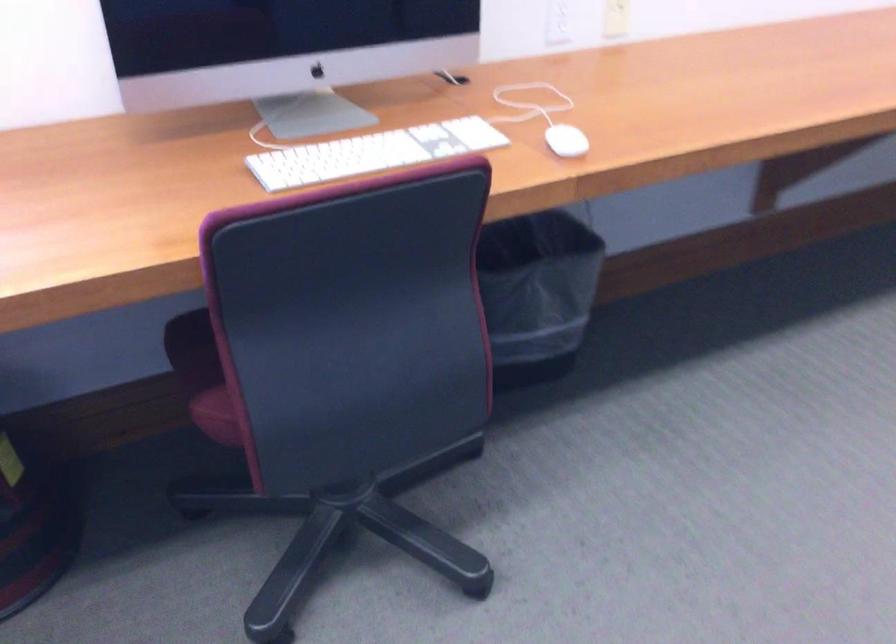
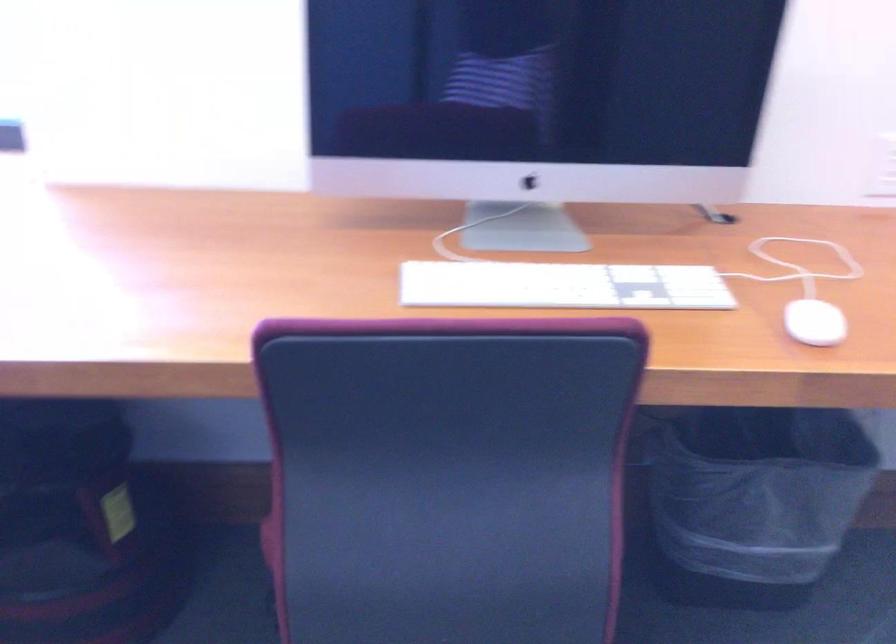
The point at (530, 294) is marked in the first image. Where is the corresponding point in the second image?

(753, 500)